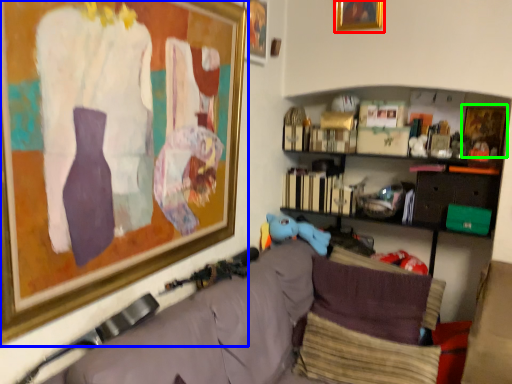
Question: Which is nearer to the picture frame (highlighted by a red box)? picture frame (highlighted by a blue box) or picture frame (highlighted by a green box).

Choices:
 (A) picture frame
 (B) picture frame

Answer: (B)